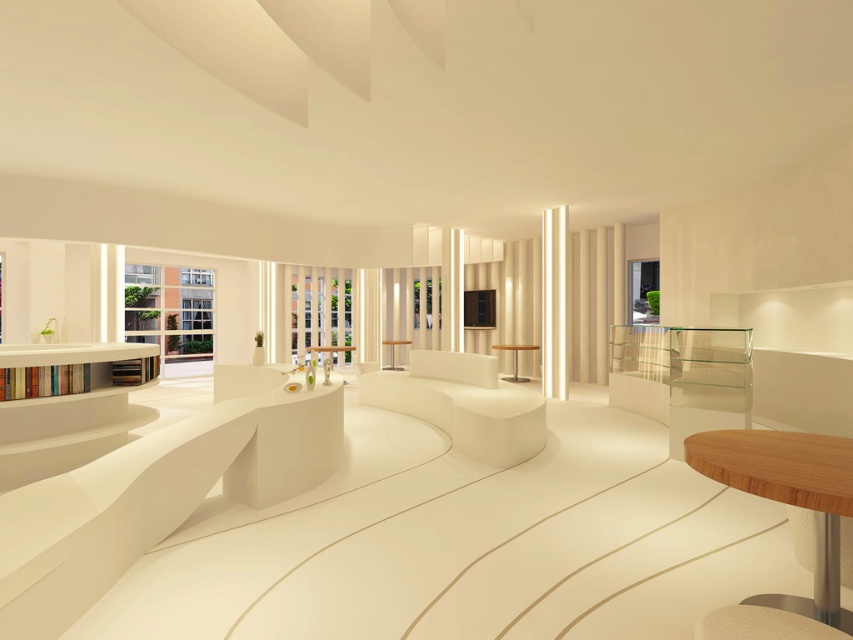
Question: Among these points, which one is nearest to the camera?

Choices:
 (A) (399, 342)
 (B) (341, 352)

Answer: (A)

Question: Does wooden table at center have a greater width compared to matte white table at center?

Choices:
 (A) no
 (B) yes

Answer: (B)

Question: Which of the following is the closest to the observer?

Choices:
 (A) (822, 518)
 (B) (480, 408)
 (C) (331, 353)

Answer: (A)

Question: Does white matte bench at center have a lesser width compared to white glossy table at center?

Choices:
 (A) yes
 (B) no

Answer: (A)

Question: Which object appears farthest from the camera in this image?

Choices:
 (A) matte white table at center
 (B) white matte bench at center
 (C) light brown wooden table at lower right
 (D) white glossy table at center

Answer: (A)

Question: Where is white glossy table at center located in relation to matte white table at center in the image?

Choices:
 (A) right
 (B) left

Answer: (B)